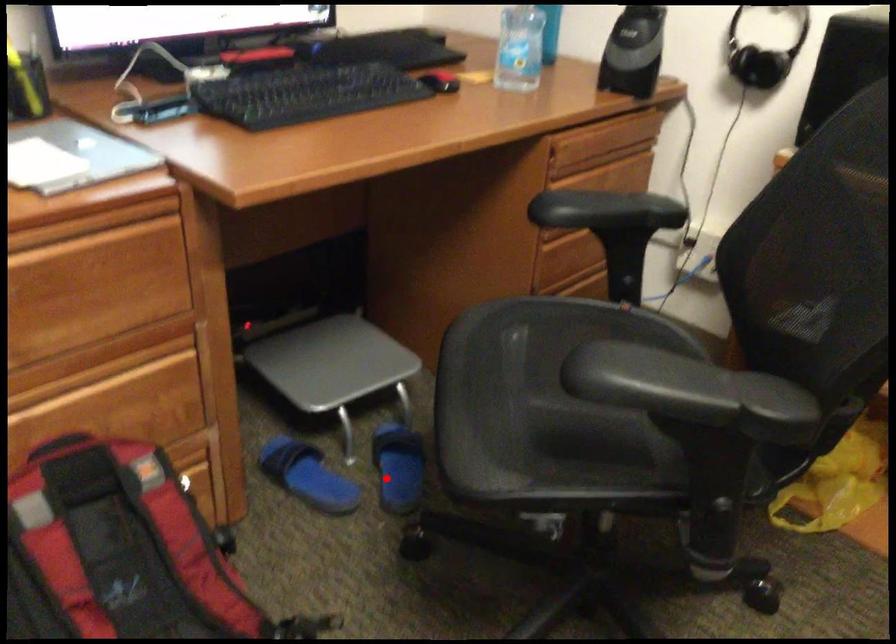
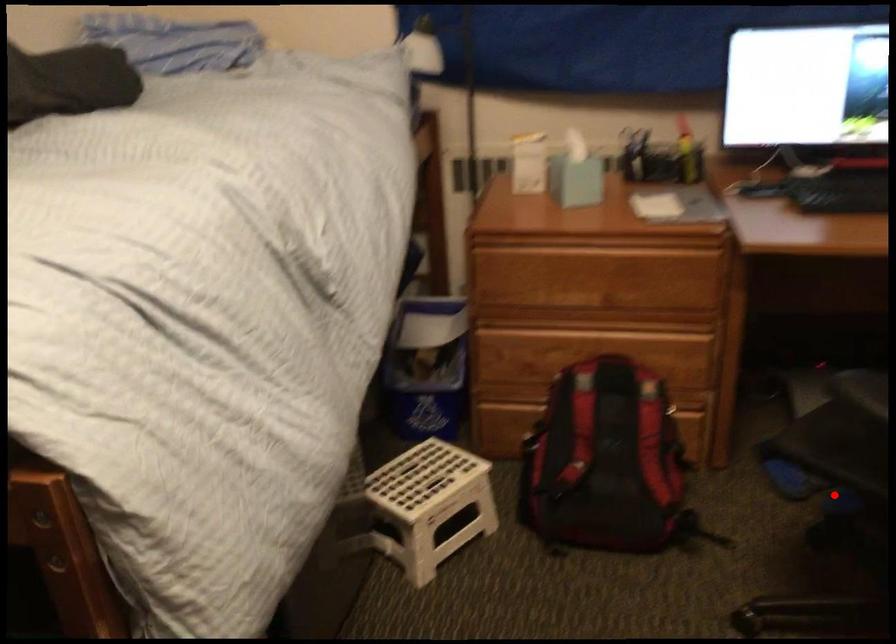
I am providing you with two images of the same scene from different viewpoints. A red point is marked on the first image and another point is marked on the second image. Do the highlighted points in image1 and image2 indicate the same real-world spot?

Yes